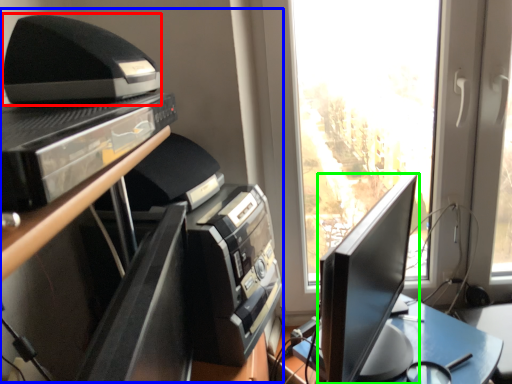
Question: Which object is positioned farthest from printer (highlighted by a red box)? Select from entertainment center (highlighted by a blue box) and computer monitor (highlighted by a green box).

Choices:
 (A) entertainment center
 (B) computer monitor

Answer: (B)